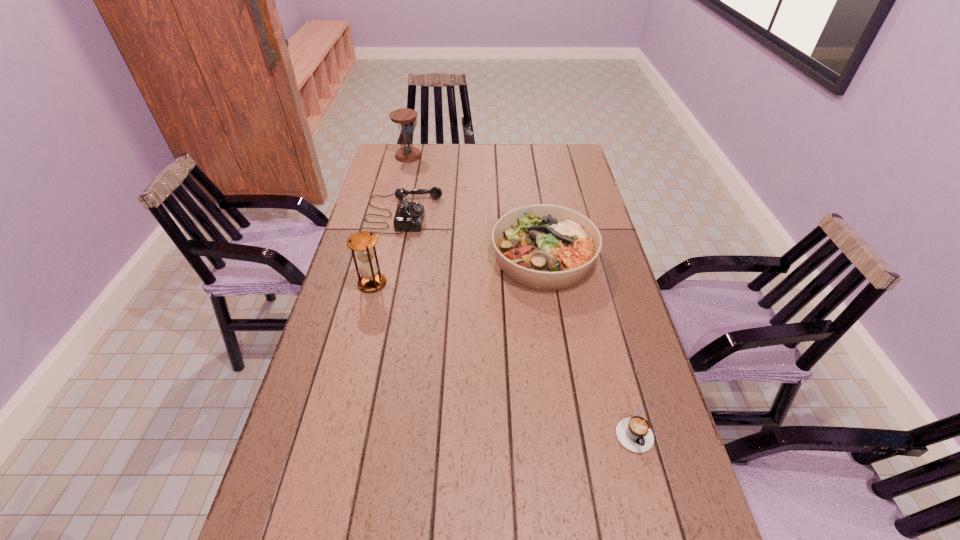
In order to click on the farther hourglass in this screenshot , I will do `click(403, 117)`.

This screenshot has height=540, width=960. What are the coordinates of `the nearer hourglass` in the screenshot? It's located at (363, 243).

Identify the location of telephone. (409, 216).

This screenshot has height=540, width=960. Find the location of `salad plate`. salad plate is located at coordinates (545, 247).

This screenshot has height=540, width=960. Find the location of `the shortest object`. the shortest object is located at coordinates (634, 433).

I want to click on the nearest object, so coord(634,433).

Find the location of `vacant space located on the right of the farther hourglass`. vacant space located on the right of the farther hourglass is located at coordinates (467, 156).

This screenshot has width=960, height=540. I want to click on free space located on the right of the nearer hourglass, so click(x=407, y=284).

Locate an element on the screen. free spot located on the dial of the telephone is located at coordinates (525, 214).

You are a GUI agent. You are given a task and a screenshot of the screen. Output one action in this format:
    pyautogui.click(x=<x>, y=<y>)
    Task: Click on the free spot located on the left of the salad plate
    
    Given the screenshot: What is the action you would take?
    pyautogui.click(x=409, y=258)